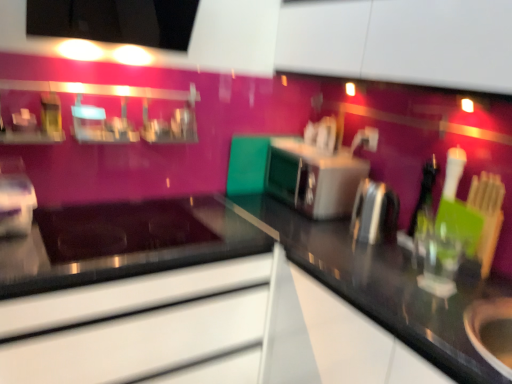
Question: Is black glossy countertop at center closer to camera compared to metallic silver kettle at right, the first appliance from the front?

Choices:
 (A) yes
 (B) no

Answer: (A)

Question: From the image's perspective, does black glossy countertop at center appear higher than metallic silver kettle at right, which is the third appliance in left-to-right order?

Choices:
 (A) yes
 (B) no

Answer: (B)

Question: Considering the relative sizes of black glossy countertop at center and metallic silver kettle at right, the first appliance from the front, in the image provided, is black glossy countertop at center taller than metallic silver kettle at right, the first appliance from the front,?

Choices:
 (A) yes
 (B) no

Answer: (A)

Question: Is black glossy countertop at center to the left of metallic silver kettle at right, the first appliance positioned from the right, from the viewer's perspective?

Choices:
 (A) yes
 (B) no

Answer: (A)

Question: Is black glossy countertop at center far away from metallic silver kettle at right, which is the third appliance in left-to-right order?

Choices:
 (A) no
 (B) yes

Answer: (A)

Question: From a real-world perspective, is black glossy countertop at center on top of metallic silver kettle at right, the first appliance positioned from the right?

Choices:
 (A) yes
 (B) no

Answer: (B)

Question: From a real-world perspective, is metallic silver kettle at right, the first appliance positioned from the right, physically below metallic silver oven at center?

Choices:
 (A) no
 (B) yes

Answer: (B)

Question: Is metallic silver kettle at right, which is the third appliance in left-to-right order, far away from metallic silver oven at center?

Choices:
 (A) yes
 (B) no

Answer: (B)

Question: Is metallic silver kettle at right, positioned as the third appliance in back-to-front order, not within metallic silver oven at center?

Choices:
 (A) no
 (B) yes

Answer: (B)

Question: From the image's perspective, is metallic silver kettle at right, the first appliance from the front, below metallic silver oven at center?

Choices:
 (A) no
 (B) yes

Answer: (B)

Question: Is metallic silver kettle at right, the first appliance from the front, turned away from metallic silver oven at center?

Choices:
 (A) yes
 (B) no

Answer: (B)

Question: Is metallic silver kettle at right, the first appliance positioned from the right, to the left of metallic silver oven at center from the viewer's perspective?

Choices:
 (A) no
 (B) yes

Answer: (A)

Question: Is black glossy countertop at center aimed at satin silver toaster at center, acting as the first appliance starting from the back?

Choices:
 (A) yes
 (B) no

Answer: (B)